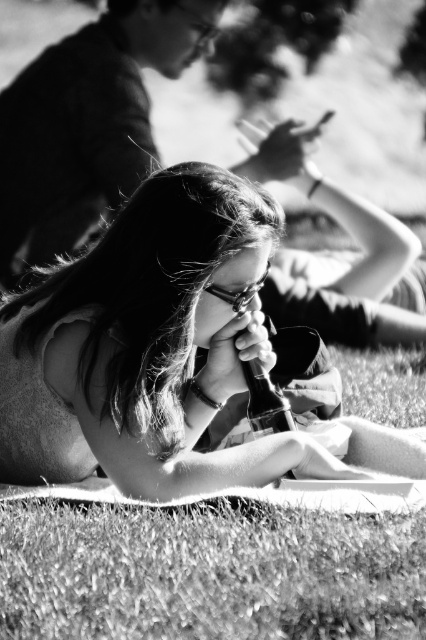
Question: Which object is farther from the camera taking this photo?

Choices:
 (A) smooth glass bottle at center
 (B) grassy at lower center

Answer: (A)

Question: Observing the image, what is the correct spatial positioning of smooth glass bottle at center in reference to grassy at lower center?

Choices:
 (A) above
 (B) below

Answer: (A)

Question: Where is smooth glass bottle at center located in relation to grassy at lower center in the image?

Choices:
 (A) right
 (B) left

Answer: (B)

Question: Does smooth glass bottle at center have a lesser width compared to grassy at lower center?

Choices:
 (A) no
 (B) yes

Answer: (A)